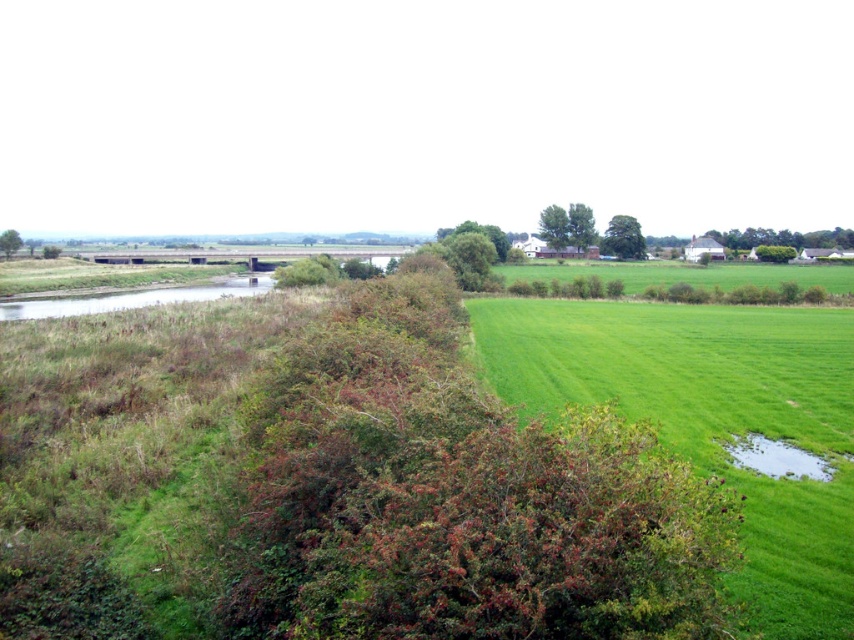
You are standing in the rural landscape and want to cross from the green grass at center to the green grassy waterway at lower left. Which direction should you move to reach the waterway?

To reach the green grassy waterway at lower left from the green grass at center, you should move backward since the green grassy waterway at lower left is behind the green grass at center.

You are standing at the point labeled as point [711,420] in the image. Looking around, you see green grass at center. Which direction should you walk to reach the dense patch of vegetation with autumnal colors?

The dense patch of vegetation with autumnal colors is located to the left of point [711,420], so you should walk to the left to reach it.

You are standing at the edge of the green grassy waterway at lower left and want to walk to the green grass at center. According to the scene description, which direction should you move to reach your destination?

The green grass at center is located below the green grassy waterway at lower left, so you should move downward to reach the green grass at center from the green grassy waterway at lower left.